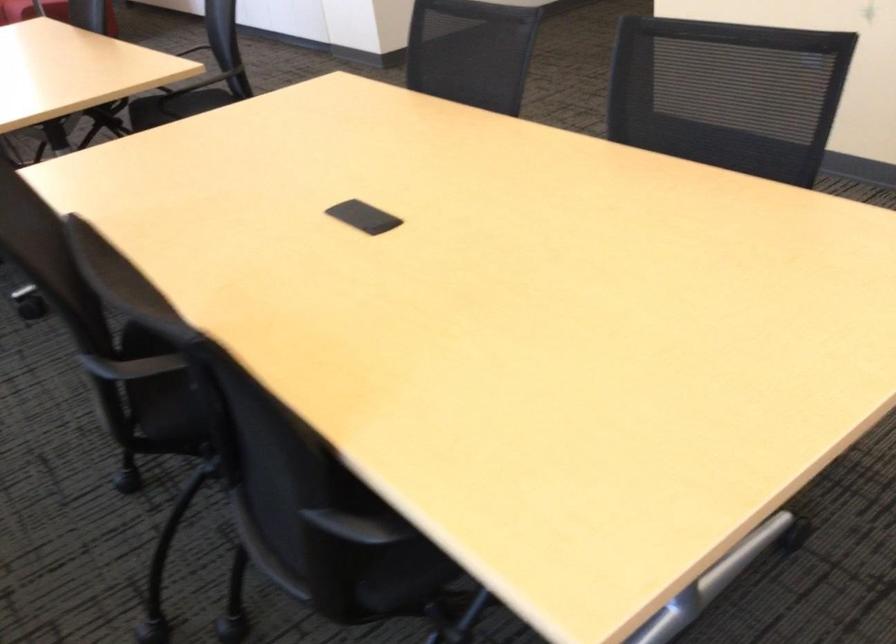
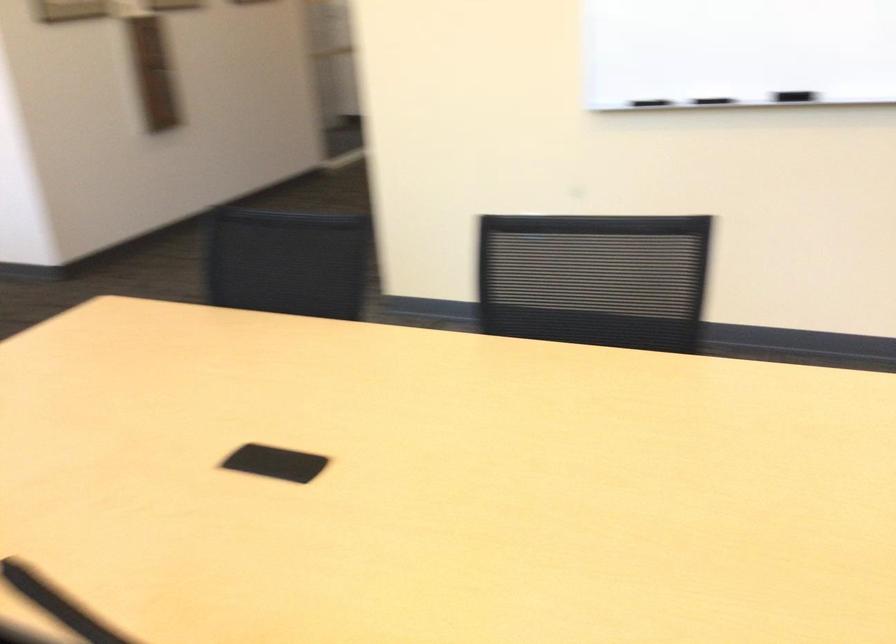
Question: Based on the continuous images, in which direction is the camera rotating? Reply with the corresponding letter.

Choices:
 (A) Left
 (B) Right
 (C) Up
 (D) Down

Answer: (B)